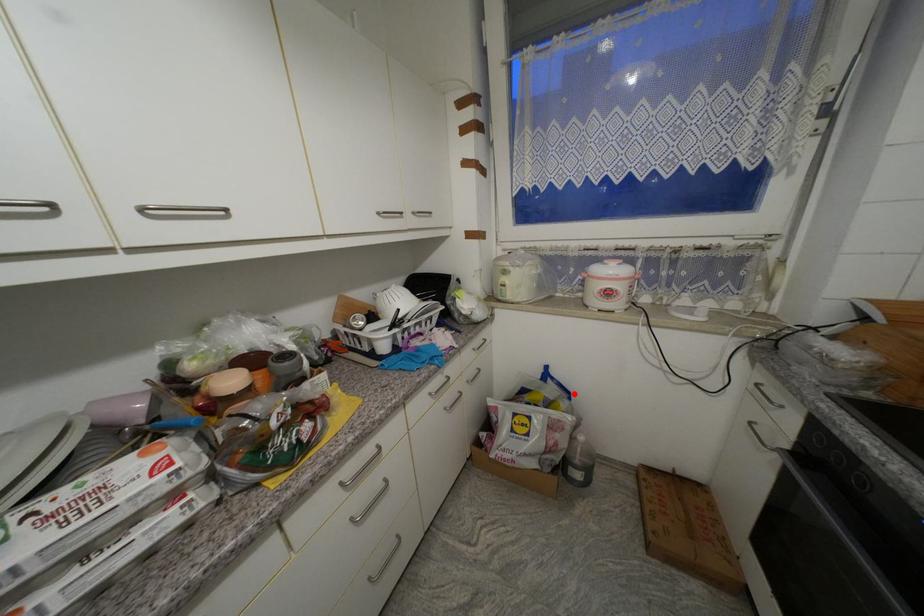
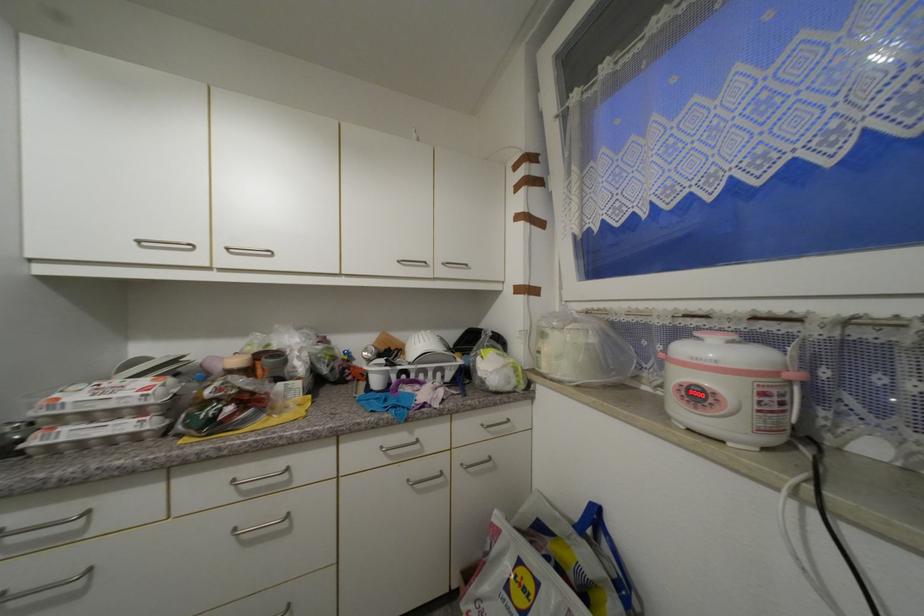
Question: I am providing you with two images of the same scene from different viewpoints. Given a red point in image1, look at the same physical point in image2. Is it:

Choices:
 (A) Closer to the viewpoint
 (B) Farther from the viewpoint

Answer: (A)